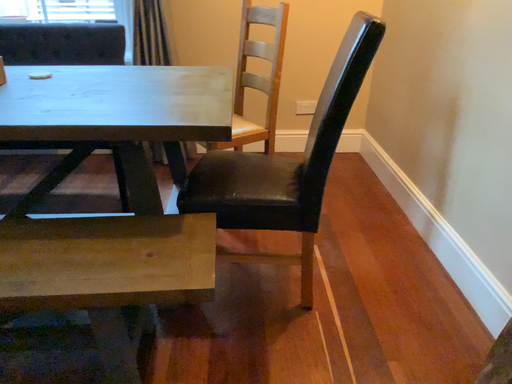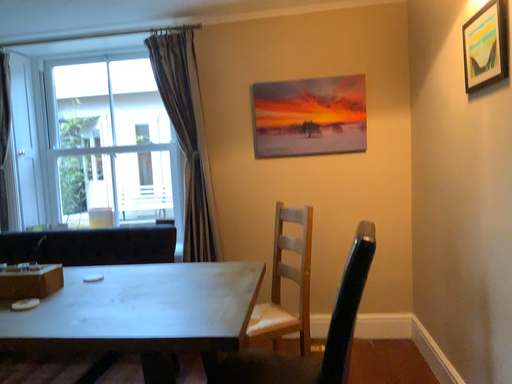
Question: Which way did the camera rotate in the video?

Choices:
 (A) rotated right
 (B) rotated left

Answer: (B)